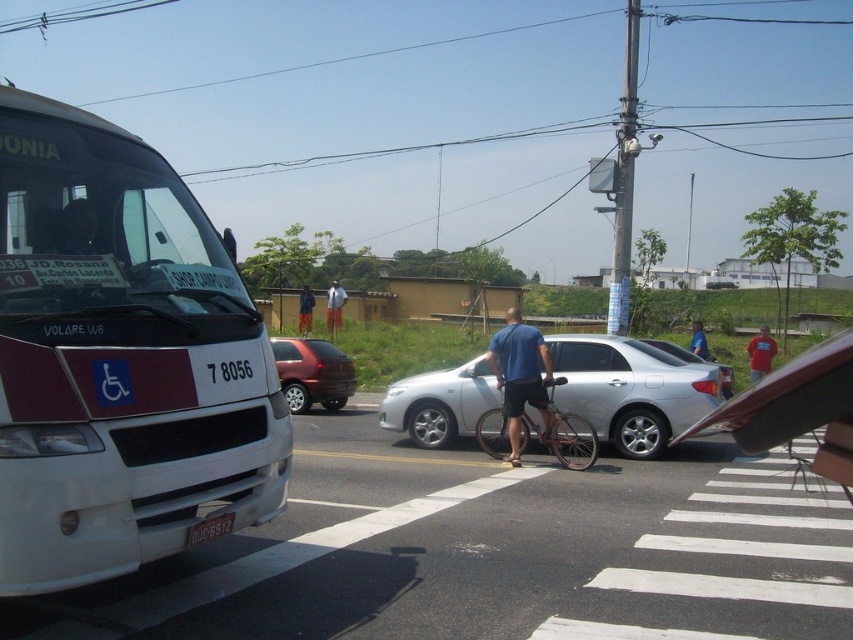
Question: Among these objects, which one is farthest from the camera?

Choices:
 (A) light blue shirt at center
 (B) blue matte shirt at center

Answer: (A)

Question: Which object is farther from the camera taking this photo?

Choices:
 (A) white matte bus at left
 (B) blue shirt at center
 (C) white painted crosswalk at lower center
 (D) light blue shirt at center

Answer: (D)

Question: Which of the following is the closest to the observer?

Choices:
 (A) (641, 340)
 (B) (339, 305)
 (C) (154, 428)
 (D) (659, 611)

Answer: (C)

Question: Does silver metallic car at center come behind red cotton shirt at center?

Choices:
 (A) no
 (B) yes

Answer: (A)

Question: Is silver metallic car at center to the left of silver metallic sedan at center from the viewer's perspective?

Choices:
 (A) yes
 (B) no

Answer: (A)

Question: Where is blue matte shirt at center located in relation to black plastic license plate at lower center in the image?

Choices:
 (A) right
 (B) left

Answer: (A)